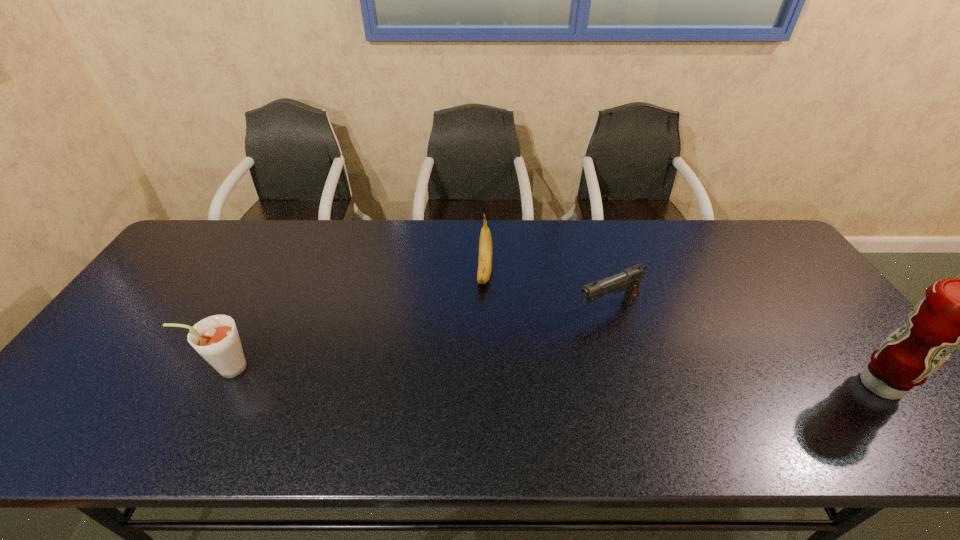
Locate an element on the screen. object present at the right edge is located at coordinates (956, 312).

Image resolution: width=960 pixels, height=540 pixels. Find the location of `object that is at the near right corner`. object that is at the near right corner is located at coordinates (956, 312).

At what (x,y) coordinates should I click in order to perform the action: click on vacant region at the far edge of the desktop. Please return your answer as a coordinate pair (x, y). The height and width of the screenshot is (540, 960). Looking at the image, I should click on (572, 227).

This screenshot has height=540, width=960. I want to click on vacant space at the near edge, so click(x=727, y=390).

At what (x,y) coordinates should I click in order to perform the action: click on free space at the far left corner. Please return your answer as a coordinate pair (x, y). Image resolution: width=960 pixels, height=540 pixels. Looking at the image, I should click on (199, 226).

The image size is (960, 540). In the image, there is a desktop. What are the coordinates of `vacant space at the far right corner` in the screenshot? It's located at (766, 230).

Identify the location of free space that is in between the rightmost object and the third object from left to right. This screenshot has height=540, width=960. coord(745,347).

This screenshot has height=540, width=960. What are the coordinates of `free space that is in between the condiment and the shortest object` in the screenshot? It's located at (745, 347).

You are a GUI agent. You are given a task and a screenshot of the screen. Output one action in this format:
    pyautogui.click(x=<x>, y=<y>)
    Task: Click on the unoccupied area between the gun and the tallest object
    This screenshot has height=540, width=960.
    Given the screenshot: What is the action you would take?
    pyautogui.click(x=745, y=347)

Where is `empty space that is in between the rightmost object and the banana`? This screenshot has width=960, height=540. empty space that is in between the rightmost object and the banana is located at coordinates (683, 329).